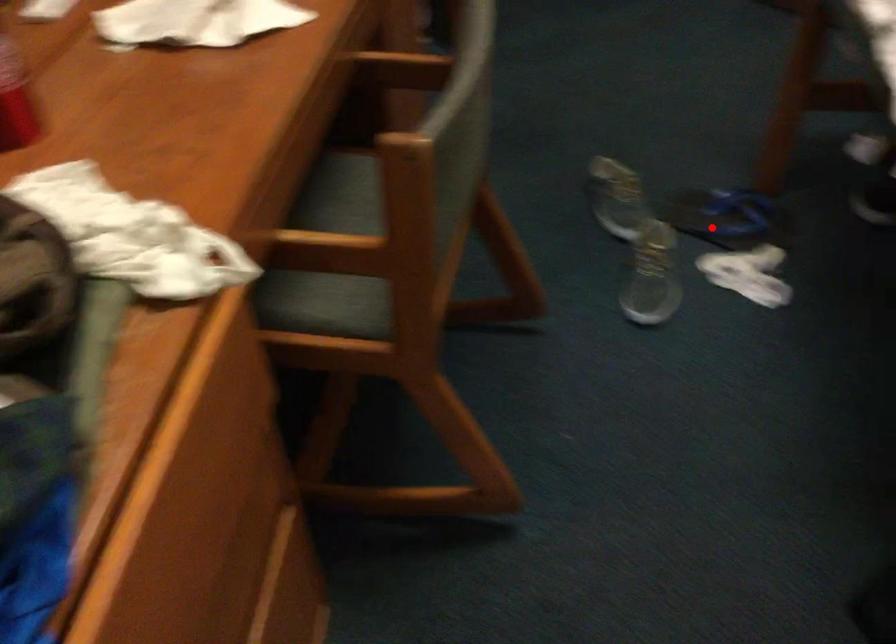
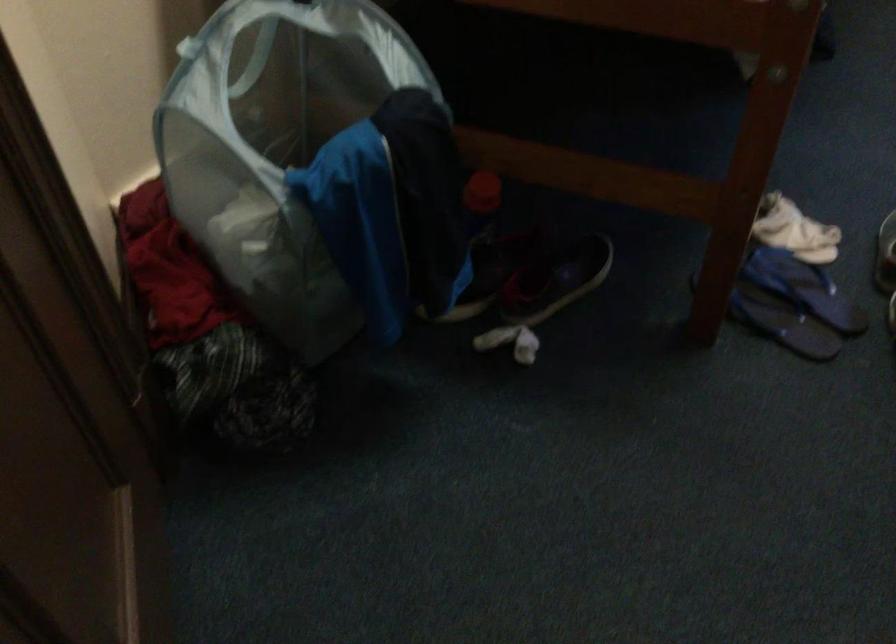
Question: A red point is marked in image1. In image2, is the corresponding 3D point closer to the camera or farther? Reply with the corresponding letter.

Choices:
 (A) The corresponding 3D point is closer.
 (B) The corresponding 3D point is farther.

Answer: (A)